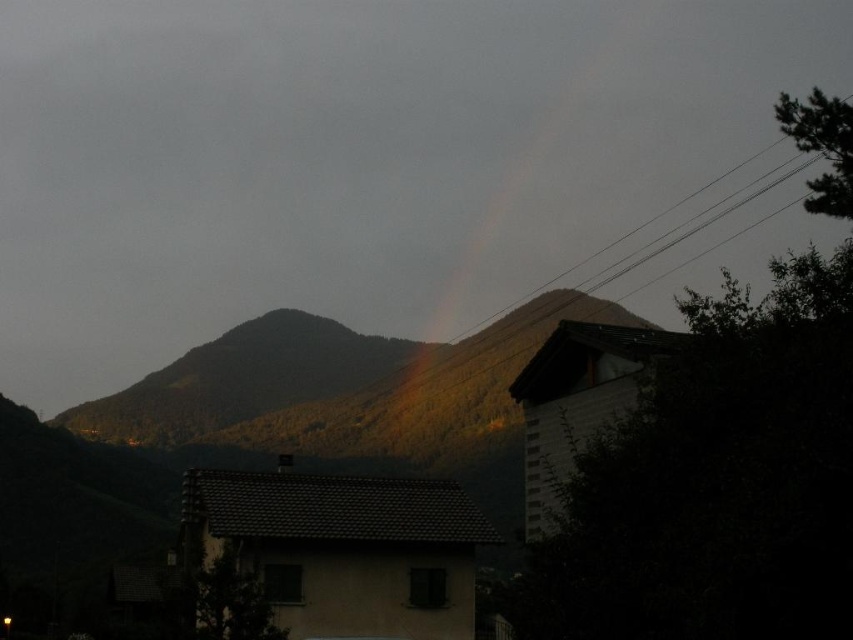
Question: Does green forested mountain at center appear under rainbow at upper center?

Choices:
 (A) no
 (B) yes

Answer: (B)

Question: Which point is closer to the camera?

Choices:
 (A) (502, 397)
 (B) (607, 64)

Answer: (A)

Question: Does green forested mountain at center have a lesser width compared to rainbow at upper center?

Choices:
 (A) yes
 (B) no

Answer: (A)

Question: Which point is closer to the camera taking this photo?

Choices:
 (A) (157, 420)
 (B) (619, 33)

Answer: (A)

Question: Is green forested mountain at center positioned before rainbow at upper center?

Choices:
 (A) yes
 (B) no

Answer: (A)